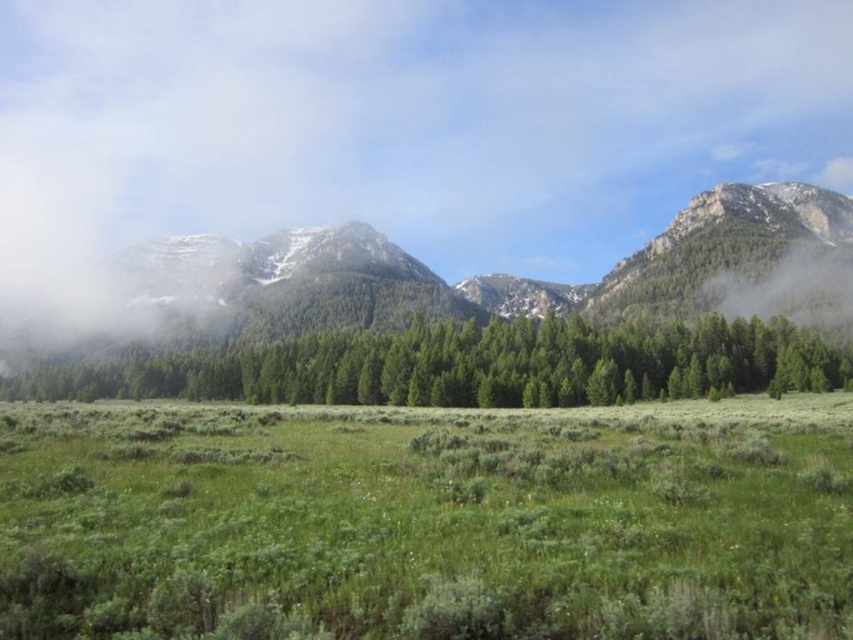
Question: Which is farther from the green soft grass at center?

Choices:
 (A) white fluffy cloud at upper center
 (B) green matte forest at center

Answer: (A)

Question: Which object is closer to the camera taking this photo?

Choices:
 (A) white fluffy cloud at upper center
 (B) green soft grass at center

Answer: (B)

Question: Does white fluffy cloud at upper center appear over green soft grass at center?

Choices:
 (A) no
 (B) yes

Answer: (B)

Question: Can you confirm if white fluffy cloud at upper center is thinner than green soft grass at center?

Choices:
 (A) no
 (B) yes

Answer: (A)

Question: Is white fluffy cloud at upper center positioned behind green soft grass at center?

Choices:
 (A) yes
 (B) no

Answer: (A)

Question: Which is farther from the green soft grass at center?

Choices:
 (A) white fluffy cloud at upper center
 (B) green matte forest at center

Answer: (A)